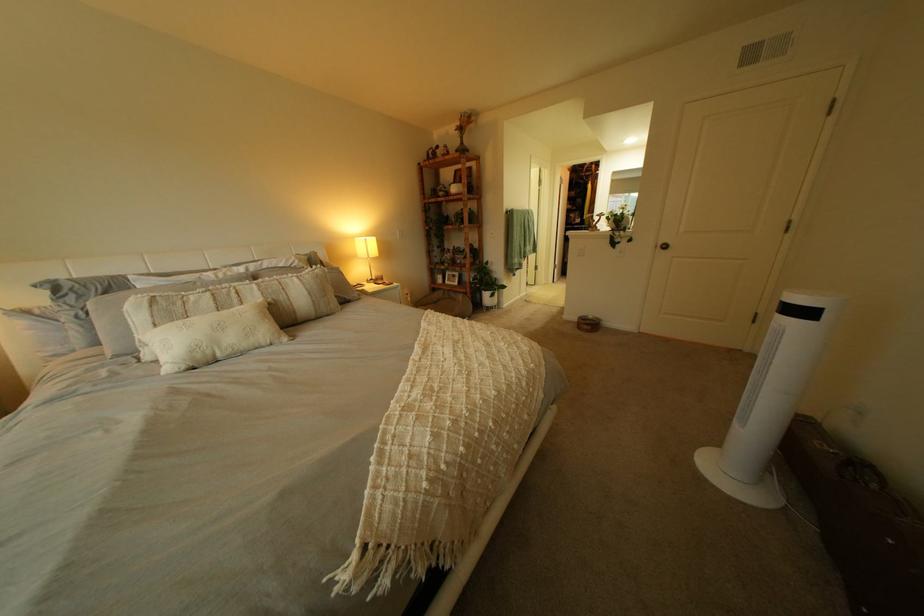
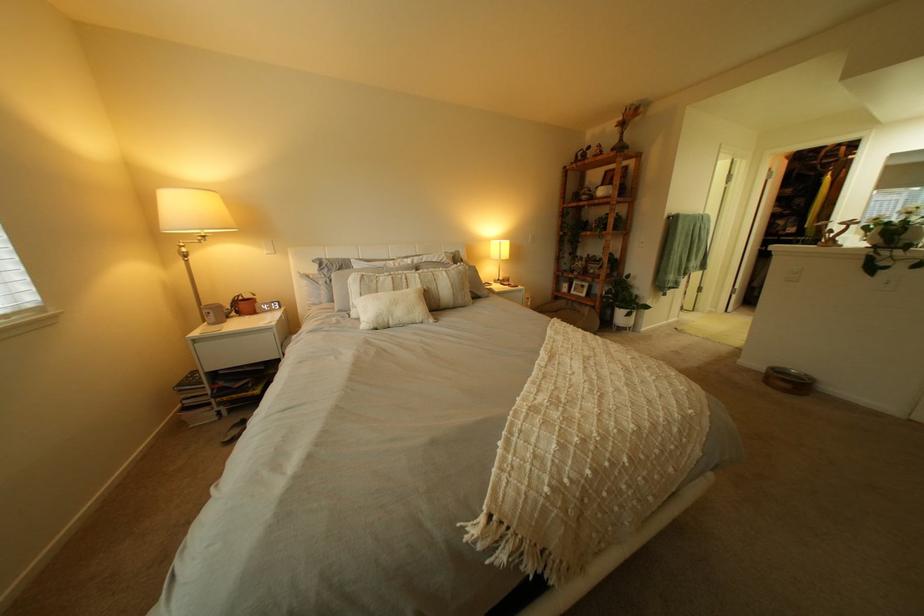
In a continuous first-person perspective shot, in which direction is the camera moving?

The cameraman moved toward left, backward.